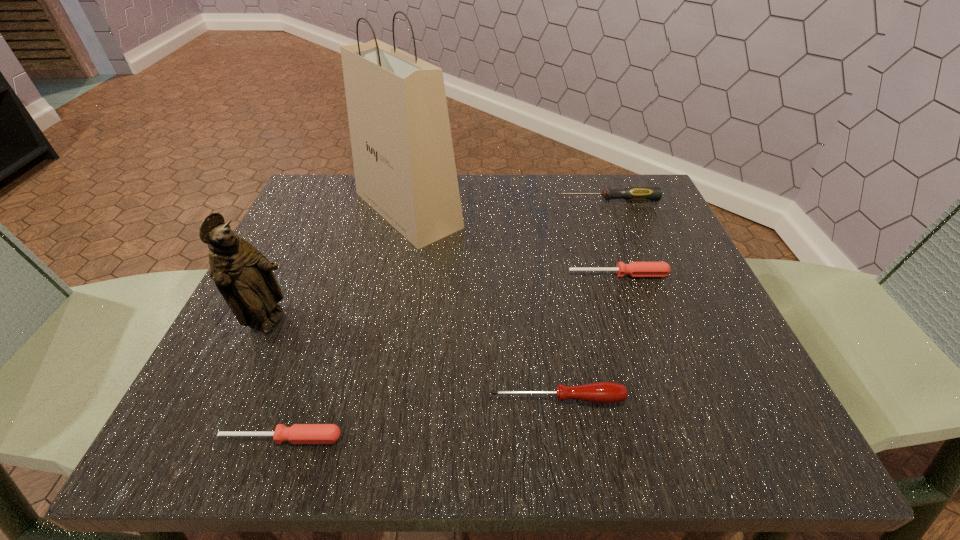
The width and height of the screenshot is (960, 540). In order to click on unoccupied area between the fifth farthest object and the third nearest screwdriver in this screenshot , I will do (588, 336).

Locate an element on the screen. The height and width of the screenshot is (540, 960). vacant area between the third farthest screwdriver and the figurine is located at coordinates (414, 361).

Find the location of a particular element. This screenshot has height=540, width=960. vacant space that's between the fifth shortest object and the leftmost screwdriver is located at coordinates click(x=276, y=380).

At what (x,y) coordinates should I click in order to perform the action: click on empty space that is in between the shopping bag and the fifth farthest object. Please return your answer as a coordinate pair (x, y). The width and height of the screenshot is (960, 540). Looking at the image, I should click on (482, 304).

Where is `vacant region between the tallest object and the figurine`? This screenshot has width=960, height=540. vacant region between the tallest object and the figurine is located at coordinates (339, 266).

The width and height of the screenshot is (960, 540). In order to click on free space between the third farthest object and the farthest screwdriver in this screenshot , I will do `click(613, 237)`.

This screenshot has height=540, width=960. In order to click on free space between the second tallest object and the third farthest screwdriver in this screenshot , I will do `click(414, 361)`.

In order to click on free space between the farthest screwdriver and the second nearest screwdriver in this screenshot , I will do [x=583, y=299].

What are the coordinates of `empty space between the leftmost screwdriver and the farthest screwdriver` in the screenshot? It's located at (444, 319).

Where is `vacant space that's between the second nearest screwdriver and the farthest screwdriver`? Image resolution: width=960 pixels, height=540 pixels. vacant space that's between the second nearest screwdriver and the farthest screwdriver is located at coordinates (583, 299).